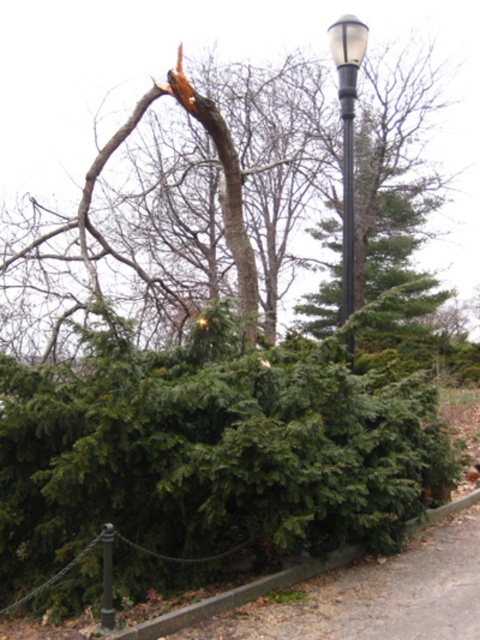
You are a city planner assessing the park layout. You need to install a new bench that is 1.2 meters wide. The bench must be placed between the matte black streetlight at upper right and the metallic gray pole at center. Can the space between them accommodate the bench?

The matte black streetlight at upper right is wider than the metallic gray pole at center. However, the question is about the space between them accommodating a bench. Since the description only provides information about their widths, not the distance between them, we cannot determine if the bench will fit based on the given information.

You are an arborist assessing the scene. You have a ladder that can reach up to 3 meters. The metallic gray pole at center is 2.5 meters tall. Can you safely reach the top of the brown rough bark tree at upper center with your ladder?

The brown rough bark tree at upper center has a greater height compared to the metallic gray pole at center, which is 2.5 meters tall. Since the tree is taller than the pole, and the ladder can reach up to 3 meters, it is possible that the tree exceeds the ladder height. Therefore, you may not be able to safely reach the top of the brown rough bark tree at upper center with your ladder.

You are a maintenance worker inspecting the area. You notice the matte black streetlight at upper right and the metallic gray pole at center. Which object is positioned higher in the scene?

The matte black streetlight at upper right is located above the metallic gray pole at center, so it is positioned higher in the scene.